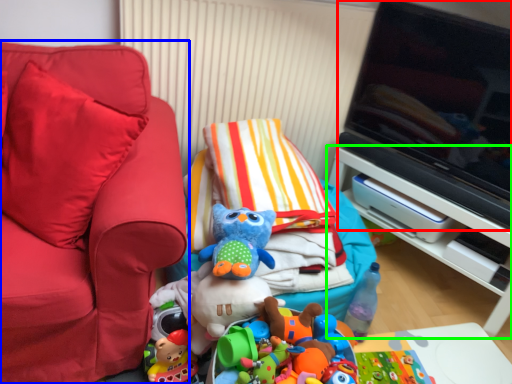
Question: Based on their relative distances, which object is farther from television (highlighted by a red box)? Choose from furniture (highlighted by a blue box) and furniture (highlighted by a green box).

Choices:
 (A) furniture
 (B) furniture

Answer: (A)